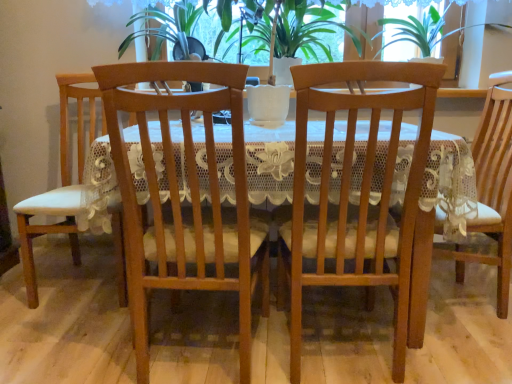
The width and height of the screenshot is (512, 384). What do you see at coordinates (307, 29) in the screenshot? I see `green leafy plant at center` at bounding box center [307, 29].

The height and width of the screenshot is (384, 512). What do you see at coordinates (62, 183) in the screenshot?
I see `white leather chair at left, the 4th chair in the right-to-left sequence` at bounding box center [62, 183].

I want to click on matte wood chair at center, which appears as the 3th chair when viewed from the right, so click(x=180, y=198).

Could you tell me if matte wood chair at center, the second chair in the right-to-left sequence, is facing transparent lace at upper center?

No, matte wood chair at center, the second chair in the right-to-left sequence, does not turn towards transparent lace at upper center.

From the image's perspective, which object appears higher, matte wood chair at center, the second chair in the right-to-left sequence, or transparent lace at upper center?

transparent lace at upper center.

Does matte wood chair at center, the second chair in the right-to-left sequence, come behind transparent lace at upper center?

No, it is in front of transparent lace at upper center.

Can you confirm if matte wood chair at center, the third chair from the left, is smaller than matte wood chair at center, which is the 4th chair in left-to-right order?

Yes.

How much distance is there between matte wood chair at center, the third chair from the left, and matte wood chair at center, positioned as the 1th chair in right-to-left order?

matte wood chair at center, the third chair from the left, and matte wood chair at center, positioned as the 1th chair in right-to-left order, are 66.79 centimeters apart from each other.

Considering the sizes of objects matte wood chair at center, the third chair from the left, and matte wood chair at center, which is the 4th chair in left-to-right order, in the image provided, who is shorter, matte wood chair at center, the third chair from the left, or matte wood chair at center, which is the 4th chair in left-to-right order,?

matte wood chair at center, the third chair from the left, is shorter.

Consider the image. Considering the sizes of objects matte wood chair at center, the second chair in the right-to-left sequence, and matte wood chair at center, which is the 4th chair in left-to-right order, in the image provided, who is wider, matte wood chair at center, the second chair in the right-to-left sequence, or matte wood chair at center, which is the 4th chair in left-to-right order,?

Wider between the two is matte wood chair at center, which is the 4th chair in left-to-right order.

Considering the relative positions of white leather chair at left, the 4th chair in the right-to-left sequence, and matte wood chair at center, the second chair in the right-to-left sequence, in the image provided, is white leather chair at left, the 4th chair in the right-to-left sequence, to the left or to the right of matte wood chair at center, the second chair in the right-to-left sequence,?

Based on their positions, white leather chair at left, the 4th chair in the right-to-left sequence, is located to the left of matte wood chair at center, the second chair in the right-to-left sequence.

Which object is thinner, white leather chair at left, which is counted as the 1th chair, starting from the left, or matte wood chair at center, the second chair in the right-to-left sequence?

With smaller width is matte wood chair at center, the second chair in the right-to-left sequence.

Are white leather chair at left, which is counted as the 1th chair, starting from the left, and matte wood chair at center, the third chair from the left, making contact?

No, white leather chair at left, which is counted as the 1th chair, starting from the left, is not in contact with matte wood chair at center, the third chair from the left.

Is white leather chair at left, the 4th chair in the right-to-left sequence, oriented away from transparent lace at upper center?

white leather chair at left, the 4th chair in the right-to-left sequence, does not have its back to transparent lace at upper center.

Who is smaller, white leather chair at left, which is counted as the 1th chair, starting from the left, or transparent lace at upper center?

transparent lace at upper center.

Image resolution: width=512 pixels, height=384 pixels. I want to click on the 1st chair positioned below the transparent lace at upper center (from a real-world perspective), so click(x=62, y=183).

What are the coordinates of `kitchen & dining room table below the matte wood chair at center, the second chair in the right-to-left sequence (from the image's perspective)` in the screenshot? It's located at (373, 177).

Which of these two, matte wood chair at center, the third chair from the left, or wooden table at center, stands shorter?

Standing shorter between the two is wooden table at center.

Looking at the image, does matte wood chair at center, the third chair from the left, seem bigger or smaller compared to wooden table at center?

Clearly, matte wood chair at center, the third chair from the left, is smaller in size than wooden table at center.

Which is behind, green leafy plant at center or transparent lace at upper center?

transparent lace at upper center is behind.

Could transparent lace at upper center be considered to be inside green leafy plant at center?

No, transparent lace at upper center is not a part of green leafy plant at center.

Between green leafy plant at center and transparent lace at upper center, which one has more height?

Standing taller between the two is transparent lace at upper center.

How different are the orientations of green leafy plant at center and transparent lace at upper center in degrees?

They differ by 4.71e-05 degrees in their facing directions.

Which object is positioned more to the right, transparent lace at upper center or green leafy plant at center?

From the viewer's perspective, transparent lace at upper center appears more on the right side.

From a real-world perspective, does transparent lace at upper center stand above green leafy plant at center?

Yes.

How far apart are transparent lace at upper center and green leafy plant at center?

18.97 inches.

From the picture: Is the depth of transparent lace at upper center greater than that of green leafy plant at center?

That is True.

Locate an element on the screen. window screen above the matte wood chair at center, the third chair from the left (from the image's perspective) is located at coordinates (452, 58).

Starting from the matte wood chair at center, positioned as the 1th chair in right-to-left order, which chair is the 1st one in front? Please provide its 2D coordinates.

[(351, 191)]

From the image, which object appears to be nearer to transparent lace at upper center, matte wood chair at center, which is the 4th chair in left-to-right order, or wooden table at center?

matte wood chair at center, which is the 4th chair in left-to-right order.

Considering their positions, is green leafy plant at center positioned further to matte wood chair at center, which is the 4th chair in left-to-right order, than matte wood chair at center, marked as the second chair in a left-to-right arrangement?

matte wood chair at center, marked as the second chair in a left-to-right arrangement, lies further to matte wood chair at center, which is the 4th chair in left-to-right order, than the other object.

Which object lies nearer to the anchor point green leafy plant at center, matte wood chair at center, positioned as the 1th chair in right-to-left order, or matte wood chair at center, the second chair in the right-to-left sequence?

matte wood chair at center, positioned as the 1th chair in right-to-left order.

Looking at the image, which one is located further to matte wood chair at center, the second chair in the right-to-left sequence, white leather chair at left, which is counted as the 1th chair, starting from the left, or matte wood chair at center, which appears as the 3th chair when viewed from the right?

white leather chair at left, which is counted as the 1th chair, starting from the left, is positioned further to the anchor matte wood chair at center, the second chair in the right-to-left sequence.

Looking at the image, which one is located further to matte wood chair at center, the second chair in the right-to-left sequence, matte wood chair at center, positioned as the 1th chair in right-to-left order, or transparent lace at upper center?

transparent lace at upper center is further to matte wood chair at center, the second chair in the right-to-left sequence.

Looking at the image, which one is located closer to transparent lace at upper center, matte wood chair at center, the third chair from the left, or green leafy plant at center?

The object closer to transparent lace at upper center is green leafy plant at center.

From the image, which object appears to be nearer to matte wood chair at center, which appears as the 3th chair when viewed from the right, white leather chair at left, which is counted as the 1th chair, starting from the left, or matte wood chair at center, positioned as the 1th chair in right-to-left order?

The object closer to matte wood chair at center, which appears as the 3th chair when viewed from the right, is white leather chair at left, which is counted as the 1th chair, starting from the left.

Which object lies nearer to the anchor point white leather chair at left, the 4th chair in the right-to-left sequence, matte wood chair at center, the second chair in the right-to-left sequence, or transparent lace at upper center?

matte wood chair at center, the second chair in the right-to-left sequence, is positioned closer to the anchor white leather chair at left, the 4th chair in the right-to-left sequence.

The image size is (512, 384). I want to click on kitchen & dining room table between white leather chair at left, which is counted as the 1th chair, starting from the left, and matte wood chair at center, the third chair from the left, in the horizontal direction, so click(373, 177).

At what (x,y) coordinates should I click in order to perform the action: click on kitchen & dining room table between matte wood chair at center, marked as the second chair in a left-to-right arrangement, and green leafy plant at center, along the z-axis. Please return your answer as a coordinate pair (x, y). This screenshot has height=384, width=512. Looking at the image, I should click on (373, 177).

The height and width of the screenshot is (384, 512). What are the coordinates of `chair situated between white leather chair at left, which is counted as the 1th chair, starting from the left, and wooden table at center from left to right` in the screenshot? It's located at (180, 198).

The image size is (512, 384). In order to click on chair located between matte wood chair at center, marked as the second chair in a left-to-right arrangement, and matte wood chair at center, which is the 4th chair in left-to-right order, in the left-right direction in this screenshot , I will do (351, 191).